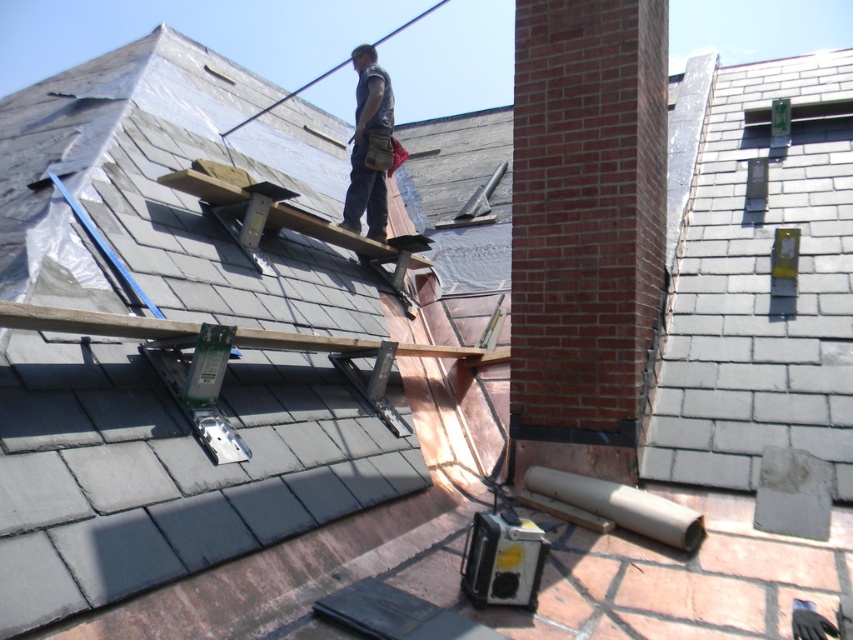
You are a construction worker standing on the roof and need to reach the brown wooden beam at center and the brown canvas tool belt at center. Which object is closer to you?

The brown wooden beam at center is closer to the viewer than the brown canvas tool belt at center, so the brown wooden beam at center is closer.

You are a construction worker standing on the roof. You need to move from the brown wooden beam at center to the brown canvas tool belt at center. Can you walk directly between them without stepping off the scaffolding?

The brown wooden beam at center and brown canvas tool belt at center are 8.04 feet apart, so yes, you can walk directly between them without stepping off the scaffolding since the distance is manageable on the scaffolding structure.

You are a drone operator trying to capture a closeup of the chimney. You have two points marked on your screen, point (9,312) and point (387,90). Which point should you focus on to get a closer shot of the chimney?

Point (9,312) is closer to the camera than point (387,90), so focusing on point (9,312) will provide a closer shot of the chimney.